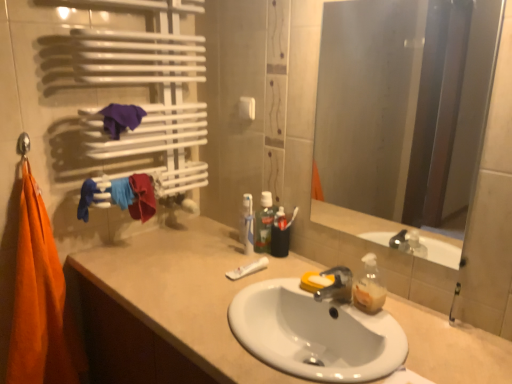
Find the location of a particular element. free space in front of white matte toothpaste at center is located at coordinates (240, 292).